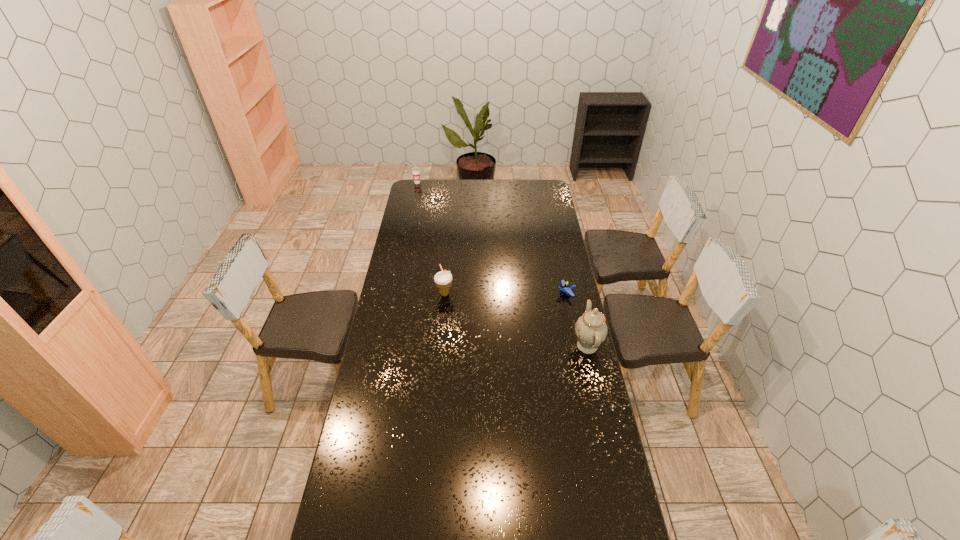
Find the location of a particular element. free point located on the front-facing side of the Lego is located at coordinates (542, 299).

You are a GUI agent. You are given a task and a screenshot of the screen. Output one action in this format:
    pyautogui.click(x=<x>, y=<y>)
    Task: Click on the vacant space located 0.070m on the front-facing side of the Lego
    The image size is (960, 540).
    Given the screenshot: What is the action you would take?
    pyautogui.click(x=544, y=299)

Identify the location of vacant area situated 0.380m on the front-facing side of the Lego. This screenshot has width=960, height=540. (481, 314).

Where is `vacant region located on the side of the farthest object with the logo`? The height and width of the screenshot is (540, 960). vacant region located on the side of the farthest object with the logo is located at coordinates (432, 207).

Locate an element on the screen. The width and height of the screenshot is (960, 540). vacant space situated on the side of the farthest object with the logo is located at coordinates (437, 215).

Identify the location of free space located on the side of the farthest object with the logo. (430, 204).

You are a GUI agent. You are given a task and a screenshot of the screen. Output one action in this format:
    pyautogui.click(x=<x>, y=<y>)
    Task: Click on the object that is positioned at the far edge
    Image resolution: width=960 pixels, height=540 pixels.
    Given the screenshot: What is the action you would take?
    pyautogui.click(x=416, y=170)

Where is `object that is at the left edge`? This screenshot has width=960, height=540. object that is at the left edge is located at coordinates (416, 170).

At what (x,y) coordinates should I click in order to perform the action: click on chinaware that is at the right edge. Please return your answer as a coordinate pair (x, y). This screenshot has height=540, width=960. Looking at the image, I should click on (591, 329).

This screenshot has height=540, width=960. I want to click on Lego that is at the right edge, so click(566, 287).